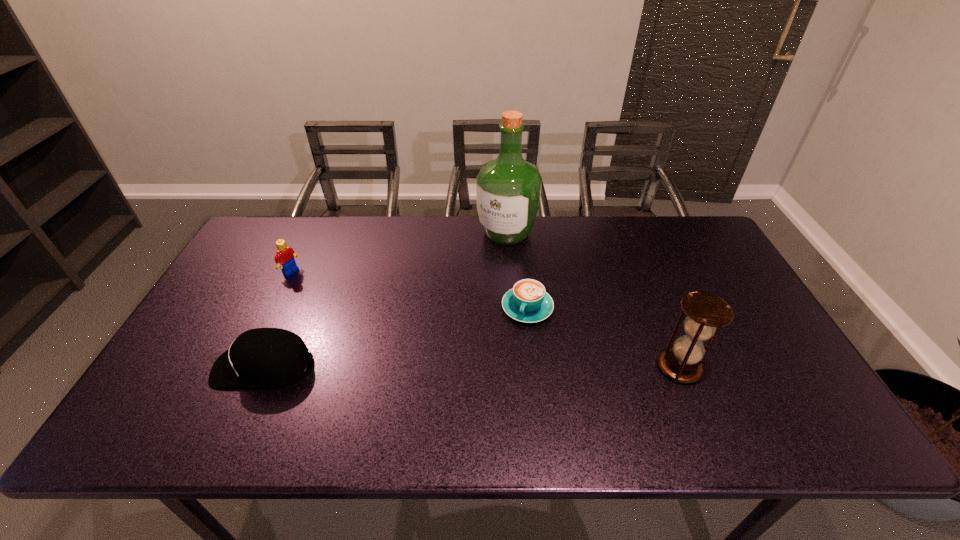
Where is `the second shortest object`? the second shortest object is located at coordinates (262, 357).

The image size is (960, 540). I want to click on the second tallest object, so click(706, 313).

The width and height of the screenshot is (960, 540). I want to click on the rightmost object, so click(x=706, y=313).

Identify the location of cappuccino. This screenshot has height=540, width=960. (528, 301).

Identify the location of the shortest object. Image resolution: width=960 pixels, height=540 pixels. (528, 301).

This screenshot has height=540, width=960. Find the location of `the fourth nearest object`. the fourth nearest object is located at coordinates (285, 255).

Image resolution: width=960 pixels, height=540 pixels. I want to click on the third tallest object, so click(285, 255).

Find the location of a particular element. the farthest object is located at coordinates (508, 189).

What are the coordinates of `liquor` in the screenshot? It's located at (508, 189).

What are the coordinates of `vacant point located on the front-facing side of the second shortest object` in the screenshot? It's located at (191, 366).